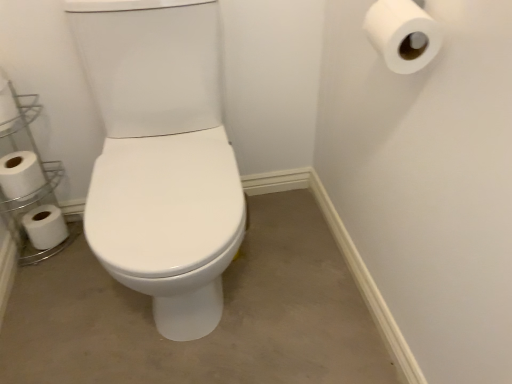
Question: Is white plastic shelf at left positioned in front of white glossy toilet at center?

Choices:
 (A) no
 (B) yes

Answer: (A)

Question: Is white plastic shelf at left oriented towards white glossy toilet at center?

Choices:
 (A) no
 (B) yes

Answer: (A)

Question: Considering the relative sizes of white plastic shelf at left and white glossy toilet at center in the image provided, is white plastic shelf at left shorter than white glossy toilet at center?

Choices:
 (A) no
 (B) yes

Answer: (A)

Question: Is white plastic shelf at left at the right side of white glossy toilet at center?

Choices:
 (A) yes
 (B) no

Answer: (B)

Question: Does white plastic shelf at left have a lesser width compared to white glossy toilet at center?

Choices:
 (A) no
 (B) yes

Answer: (B)

Question: From a real-world perspective, is white plastic shelf at left physically located above or below white glossy toilet at center?

Choices:
 (A) above
 (B) below

Answer: (A)

Question: Is white plastic shelf at left in front of or behind white glossy toilet at center in the image?

Choices:
 (A) front
 (B) behind

Answer: (B)

Question: Is white plastic shelf at left taller or shorter than white glossy toilet at center?

Choices:
 (A) short
 (B) tall

Answer: (B)

Question: Visually, is white plastic shelf at left positioned to the left or to the right of white glossy toilet at center?

Choices:
 (A) right
 (B) left

Answer: (B)

Question: From their relative heights in the image, would you say white matte toilet paper at lower left, the fourth toilet paper viewed from the top, is taller or shorter than white plastic shelf at left?

Choices:
 (A) tall
 (B) short

Answer: (B)

Question: Is point (24, 215) closer or farther from the camera than point (35, 97)?

Choices:
 (A) closer
 (B) farther

Answer: (B)

Question: From the image's perspective, relative to white plastic shelf at left, is white matte toilet paper at lower left, which is the 4th toilet paper in front-to-back order, above or below?

Choices:
 (A) below
 (B) above

Answer: (A)

Question: Based on their positions, is white matte toilet paper at lower left, which is counted as the 1th toilet paper, starting from the bottom, located to the left or right of white plastic shelf at left?

Choices:
 (A) left
 (B) right

Answer: (A)

Question: In terms of height, does white matte toilet paper at left, which is the 2th toilet paper from top to bottom, look taller or shorter compared to white glossy toilet at center?

Choices:
 (A) tall
 (B) short

Answer: (A)

Question: Considering the relative positions of white matte toilet paper at left, which is the 2th toilet paper from top to bottom, and white glossy toilet at center in the image provided, is white matte toilet paper at left, which is the 2th toilet paper from top to bottom, to the left or to the right of white glossy toilet at center?

Choices:
 (A) right
 (B) left

Answer: (B)